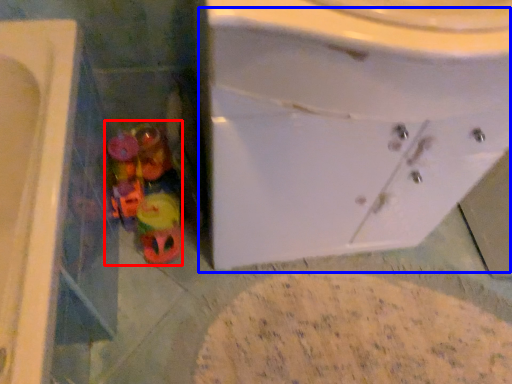
Question: Among these objects, which one is nearest to the camera, toy (highlighted by a red box) or sink (highlighted by a blue box)?

Choices:
 (A) toy
 (B) sink

Answer: (B)